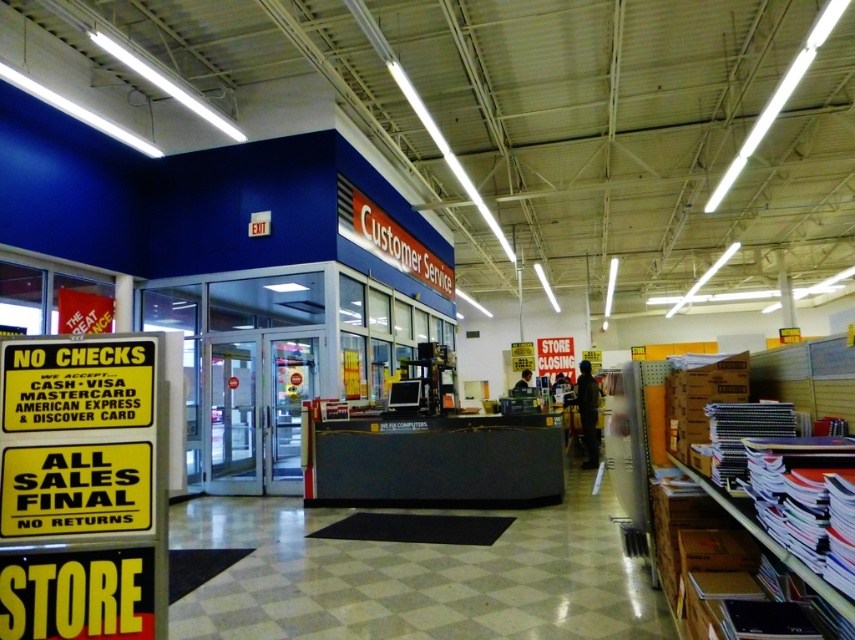
Question: Which of the following is the farthest from the observer?

Choices:
 (A) dark clothing figure at center
 (B) stacked paper at right

Answer: (A)

Question: Is stacked paper at right smaller than dark clothing figure at center?

Choices:
 (A) no
 (B) yes

Answer: (A)

Question: Does stacked paper at right come in front of dark clothing figure at center?

Choices:
 (A) yes
 (B) no

Answer: (A)

Question: Considering the relative positions of stacked paper at right and dark clothing figure at center in the image provided, where is stacked paper at right located with respect to dark clothing figure at center?

Choices:
 (A) below
 (B) above

Answer: (B)